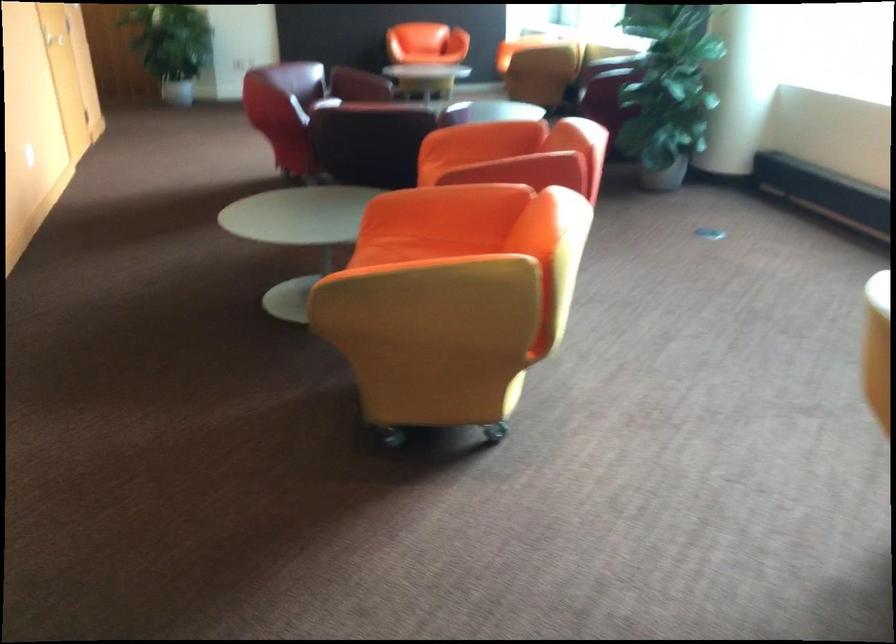
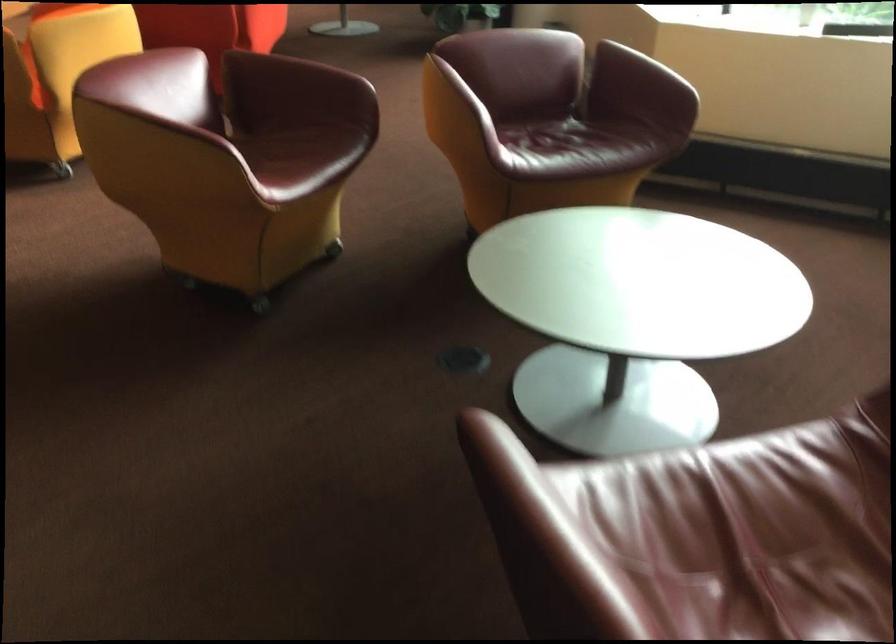
Question: Which direction would the cameraman need to move to produce the second image? Reply with the corresponding letter.

Choices:
 (A) Left
 (B) Right
 (C) Forward
 (D) Backward

Answer: (B)